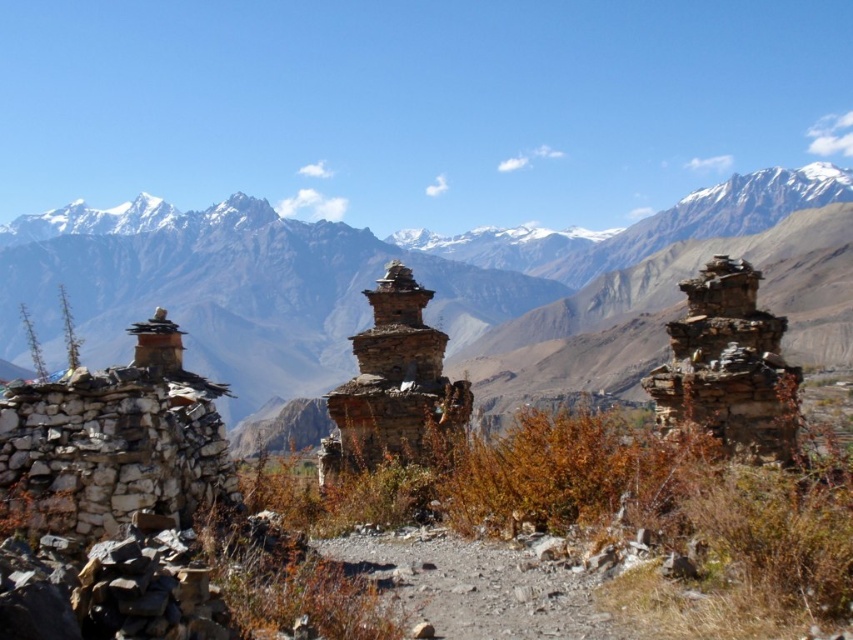
Who is more forward, (201, 221) or (749, 280)?

Point (749, 280)

Does point (544, 348) come closer to viewer compared to point (720, 371)?

No, it is behind (720, 371).

Who is more distant from viewer, (358, 243) or (776, 365)?

The point (358, 243) is behind.

Locate an element on the screen. The image size is (853, 640). rugged stone mountain range at center is located at coordinates (433, 298).

Can you confirm if rugged stone mountain range at center is positioned to the right of brown stone stupa at center?

Incorrect, rugged stone mountain range at center is not on the right side of brown stone stupa at center.

Is rugged stone mountain range at center smaller than brown stone stupa at center?

No.

This screenshot has width=853, height=640. Identify the location of rugged stone mountain range at center. (x=433, y=298).

Locate an element on the screen. rugged stone mountain range at center is located at coordinates (433, 298).

Who is taller, rustic stone stupa at right or brown stone stupa at center?

Standing taller between the two is brown stone stupa at center.

Between rustic stone stupa at right and brown stone stupa at center, which one is positioned higher?

rustic stone stupa at right is above.

This screenshot has height=640, width=853. What do you see at coordinates (728, 365) in the screenshot?
I see `rustic stone stupa at right` at bounding box center [728, 365].

This screenshot has width=853, height=640. What are the coordinates of `rustic stone stupa at right` in the screenshot? It's located at (728, 365).